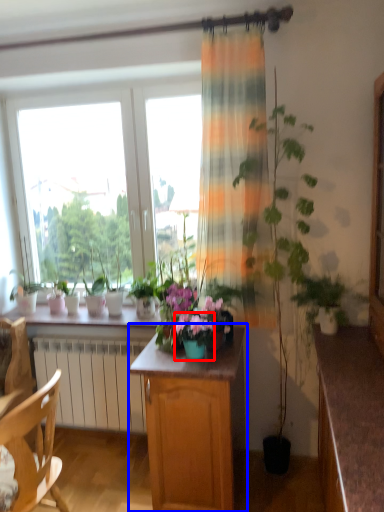
Question: Which point is further to the camera, flower box (highlighted by a red box) or cabinetry (highlighted by a blue box)?

Choices:
 (A) flower box
 (B) cabinetry

Answer: (A)